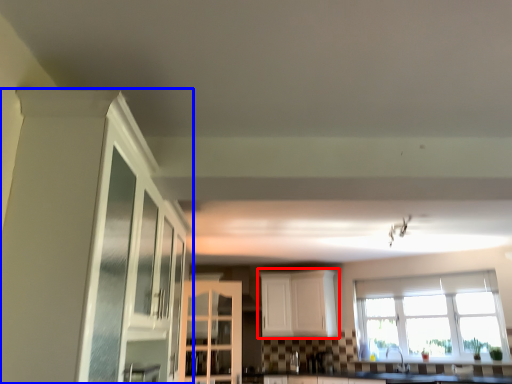
Question: Which object is further to the camera taking this photo, cabinetry (highlighted by a red box) or cabinetry (highlighted by a blue box)?

Choices:
 (A) cabinetry
 (B) cabinetry

Answer: (A)